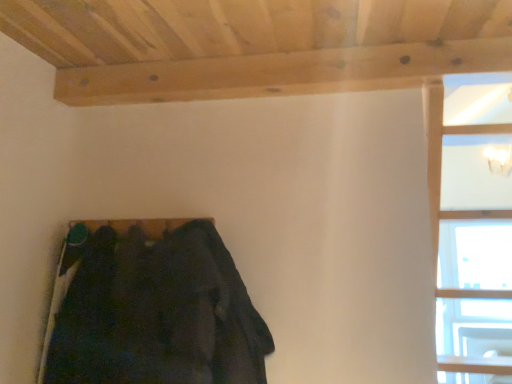
The width and height of the screenshot is (512, 384). I want to click on transparent glass window at upper right, so click(472, 224).

Measure the distance between transparent glass window at upper right and camera.

transparent glass window at upper right and camera are 3.95 feet apart from each other.

What do you see at coordinates (472, 224) in the screenshot? Image resolution: width=512 pixels, height=384 pixels. I see `transparent glass window at upper right` at bounding box center [472, 224].

Find the location of `transparent glass window at upper right`. transparent glass window at upper right is located at coordinates (472, 224).